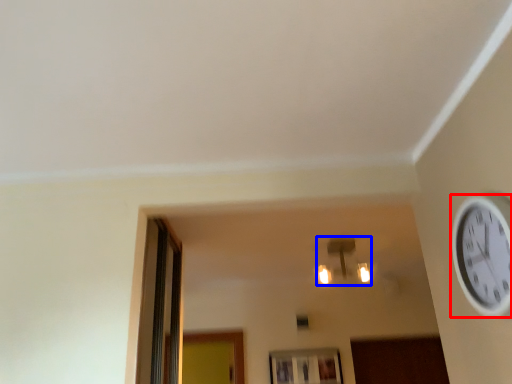
Question: Which point is further to the camera, wall clock (highlighted by a red box) or light fixture (highlighted by a blue box)?

Choices:
 (A) wall clock
 (B) light fixture

Answer: (B)